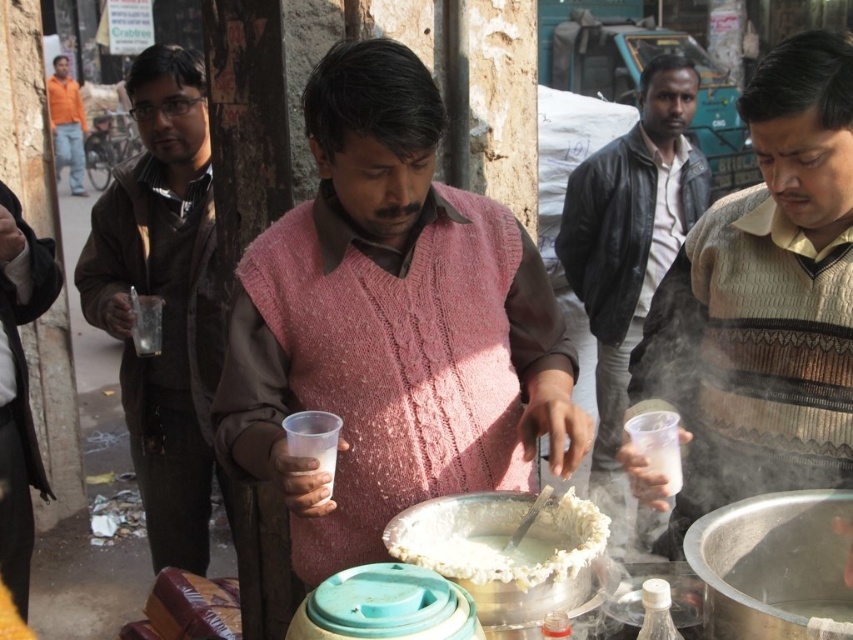
You are a customer at the street food stall. You notice the leather jacket at center and the white creamy food at center. Which item is taller?

The leather jacket at center is taller than the white creamy food at center.

You are a customer waiting in line to order from the street vendor. You notice a leather jacket at center and a white creamy food at center. How far apart are these two items from each other?

The leather jacket at center and the white creamy food at center are 2.56 meters apart from each other.

Based on the photo, you are a customer at the street food stall. You notice the brown leather jacket at left and the white creamy food at center. Which object is closer to the vendor?

The brown leather jacket at left is taller than the white creamy food at center, so the brown leather jacket at left is closer to the vendor.